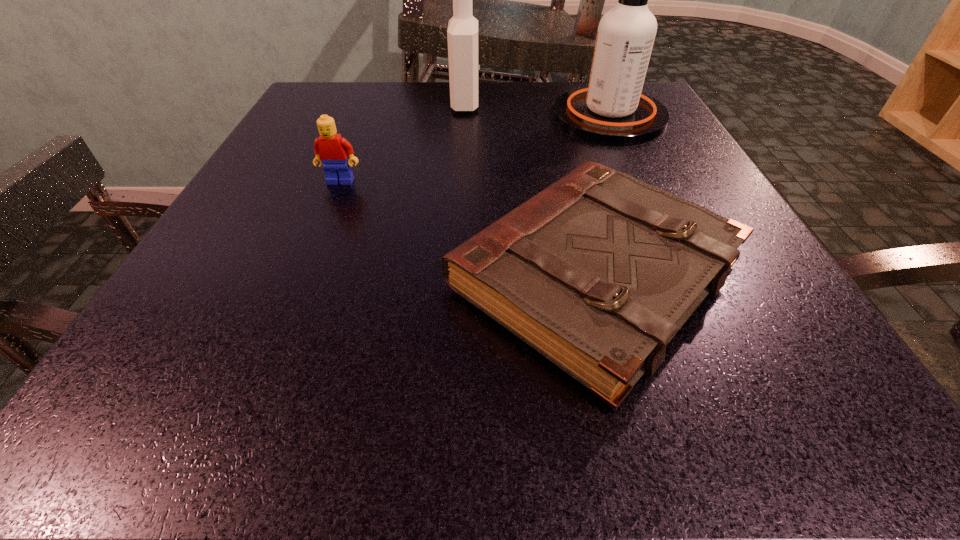
The height and width of the screenshot is (540, 960). I want to click on the left cleansing agent, so click(x=462, y=35).

You are a GUI agent. You are given a task and a screenshot of the screen. Output one action in this format:
    pyautogui.click(x=<x>, y=<y>)
    Task: Click on the right cleansing agent
    
    Given the screenshot: What is the action you would take?
    pyautogui.click(x=612, y=109)

Identify the location of the third tallest object. 332,150.

The height and width of the screenshot is (540, 960). What are the coordinates of `the leftmost object` in the screenshot? It's located at (332, 150).

Find the location of a particular element. This screenshot has height=540, width=960. hardback book is located at coordinates (597, 272).

Locate an element on the screen. The image size is (960, 540). the nearest object is located at coordinates (597, 272).

This screenshot has height=540, width=960. I want to click on vacant region located on the front label of the left cleansing agent, so click(536, 104).

Find the location of a particular element. vacant space located 0.240m on the front of the right cleansing agent is located at coordinates (657, 220).

Locate an element on the screen. The height and width of the screenshot is (540, 960). free region located 0.200m on the face of the third tallest object is located at coordinates (306, 267).

You are a GUI agent. You are given a task and a screenshot of the screen. Output one action in this format:
    pyautogui.click(x=<x>, y=<y>)
    Task: Click on the vacant region located on the back of the shortest object
    Image resolution: width=960 pixels, height=540 pixels.
    Given the screenshot: What is the action you would take?
    pyautogui.click(x=548, y=102)